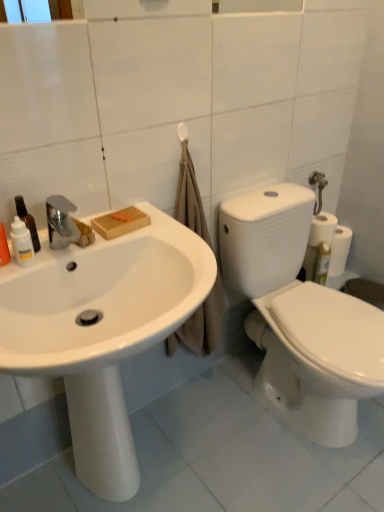
You are a GUI agent. You are given a task and a screenshot of the screen. Output one action in this format:
    pyautogui.click(x=<x>, y=<y>)
    Task: Click on the free area below white glossy sink at left (from a real-world perspective)
    This screenshot has height=512, width=384.
    Given the screenshot: What is the action you would take?
    pyautogui.click(x=145, y=468)